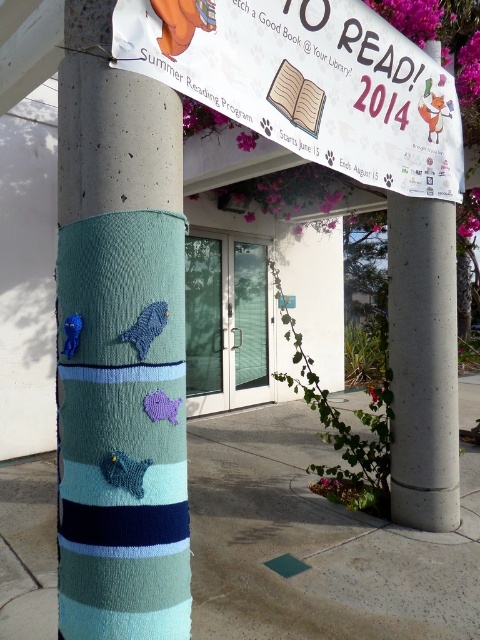
Question: Which point is closer to the camera?

Choices:
 (A) (120, 211)
 (B) (403, 374)

Answer: (A)

Question: Is white paper banner at upper center to the right of concrete at right from the viewer's perspective?

Choices:
 (A) yes
 (B) no

Answer: (B)

Question: Can you confirm if teal knitted yarn at center is positioned to the right of concrete at right?

Choices:
 (A) no
 (B) yes

Answer: (A)

Question: Which point is farther to the camera?

Choices:
 (A) teal knitted yarn at center
 (B) concrete at right
 (C) white paper banner at upper center

Answer: (B)

Question: Which object is the farthest from the teal knitted yarn at center?

Choices:
 (A) concrete at right
 (B) white paper banner at upper center

Answer: (A)

Question: In this image, where is teal knitted yarn at center located relative to concrete at right?

Choices:
 (A) right
 (B) left

Answer: (B)